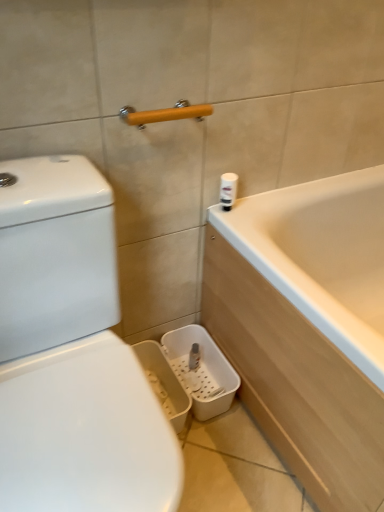
Identify the location of yellow matte towel bar at upper center. (165, 114).

What do you see at coordinates (165, 114) in the screenshot?
I see `yellow matte towel bar at upper center` at bounding box center [165, 114].

What is the approximate width of white plastic canister at upper right?

The width of white plastic canister at upper right is 1.88 inches.

Where is `white plastic canister at upper right`? Image resolution: width=384 pixels, height=512 pixels. white plastic canister at upper right is located at coordinates (228, 190).

What do you see at coordinates (228, 190) in the screenshot? I see `white plastic canister at upper right` at bounding box center [228, 190].

The image size is (384, 512). In order to click on yellow matte towel bar at upper center in this screenshot , I will do `click(165, 114)`.

Is yellow matte towel bar at upper center to the left of white plastic canister at upper right from the viewer's perspective?

Indeed, yellow matte towel bar at upper center is positioned on the left side of white plastic canister at upper right.

Is yellow matte towel bar at upper center behind white plastic canister at upper right?

No, yellow matte towel bar at upper center is closer to the viewer.

Between point (154, 118) and point (223, 205), which one is positioned in front?

The point (154, 118) is closer to the camera.

From the image's perspective, which is below, yellow matte towel bar at upper center or white plastic canister at upper right?

white plastic canister at upper right.

From a real-world perspective, which is physically above, yellow matte towel bar at upper center or white plastic canister at upper right?

yellow matte towel bar at upper center is physically above.

Considering the sizes of yellow matte towel bar at upper center and white plastic canister at upper right in the image, is yellow matte towel bar at upper center wider or thinner than white plastic canister at upper right?

yellow matte towel bar at upper center is wider than white plastic canister at upper right.

Considering the relative sizes of yellow matte towel bar at upper center and white plastic canister at upper right in the image provided, is yellow matte towel bar at upper center shorter than white plastic canister at upper right?

Yes.

Considering the relative sizes of yellow matte towel bar at upper center and white plastic canister at upper right in the image provided, is yellow matte towel bar at upper center smaller than white plastic canister at upper right?

No, yellow matte towel bar at upper center is not smaller than white plastic canister at upper right.

Is yellow matte towel bar at upper center not within white plastic canister at upper right?

yellow matte towel bar at upper center is positioned outside white plastic canister at upper right.

Is yellow matte towel bar at upper center not near white plastic canister at upper right?

No, yellow matte towel bar at upper center is in close proximity to white plastic canister at upper right.

Is yellow matte towel bar at upper center turned away from white plastic canister at upper right?

No, white plastic canister at upper right is not at the back of yellow matte towel bar at upper center.

Measure the distance between yellow matte towel bar at upper center and white plastic canister at upper right.

They are 10.37 inches apart.

This screenshot has height=512, width=384. Identify the location of toiletry behind the yellow matte towel bar at upper center. (228, 190).

Is white plastic canister at upper right to the left or to the right of yellow matte towel bar at upper center in the image?

Clearly, white plastic canister at upper right is on the right of yellow matte towel bar at upper center in the image.

Between white plastic canister at upper right and yellow matte towel bar at upper center, which one is positioned in front?

yellow matte towel bar at upper center is closer to the camera.

Which is farther, (223, 175) or (180, 119)?

Positioned behind is point (223, 175).

From the image's perspective, is white plastic canister at upper right located above yellow matte towel bar at upper center?

No, from the image's perspective, white plastic canister at upper right is not on top of yellow matte towel bar at upper center.

From a real-world perspective, who is located lower, white plastic canister at upper right or yellow matte towel bar at upper center?

In real-world perspective, white plastic canister at upper right is lower.

Between white plastic canister at upper right and yellow matte towel bar at upper center, which one has smaller width?

Result: white plastic canister at upper right.

Considering the sizes of objects white plastic canister at upper right and yellow matte towel bar at upper center in the image provided, who is shorter, white plastic canister at upper right or yellow matte towel bar at upper center?

Standing shorter between the two is yellow matte towel bar at upper center.

Looking at this image, does white plastic canister at upper right have a smaller size compared to yellow matte towel bar at upper center?

Yes.

Is white plastic canister at upper right positioned beyond the bounds of yellow matte towel bar at upper center?

Yes, white plastic canister at upper right is outside of yellow matte towel bar at upper center.

Does white plastic canister at upper right touch yellow matte towel bar at upper center?

There is a gap between white plastic canister at upper right and yellow matte towel bar at upper center.

Is white plastic canister at upper right looking in the opposite direction of yellow matte towel bar at upper center?

No, white plastic canister at upper right is not facing the opposite direction of yellow matte towel bar at upper center.

What's the angular difference between white plastic canister at upper right and yellow matte towel bar at upper center's facing directions?

3.06 degrees.

In the scene shown: Could you measure the distance between white plastic canister at upper right and yellow matte towel bar at upper center?

white plastic canister at upper right and yellow matte towel bar at upper center are 10.37 inches apart from each other.

At what (x,y) coordinates should I click in order to perform the action: click on towel bar located above the white plastic canister at upper right (from the image's perspective). Please return your answer as a coordinate pair (x, y). The width and height of the screenshot is (384, 512). Looking at the image, I should click on (165, 114).

This screenshot has width=384, height=512. In order to click on towel bar on the left of white plastic canister at upper right in this screenshot , I will do `click(165, 114)`.

In order to click on toiletry below the yellow matte towel bar at upper center (from a real-world perspective) in this screenshot , I will do `click(228, 190)`.